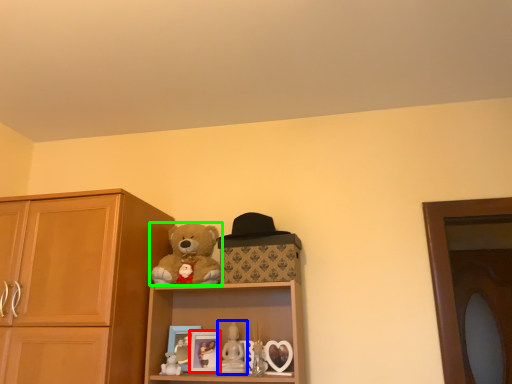
Question: Which object is positioned farthest from picture frame (highlighted by a red box)? Select from figurine (highlighted by a blue box) and teddy bear (highlighted by a green box).

Choices:
 (A) figurine
 (B) teddy bear

Answer: (B)